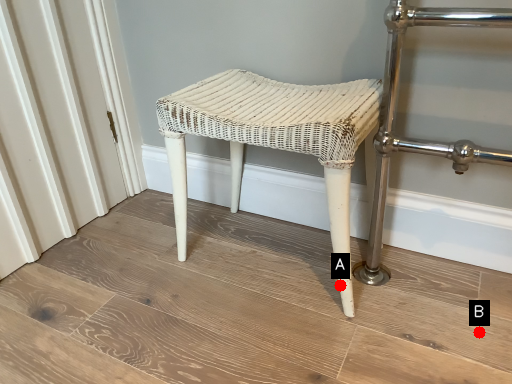
Question: Two points are circled on the image, labeled by A and B beside each circle. Among these points, which one is nearest to the camera?

Choices:
 (A) A is closer
 (B) B is closer

Answer: (B)